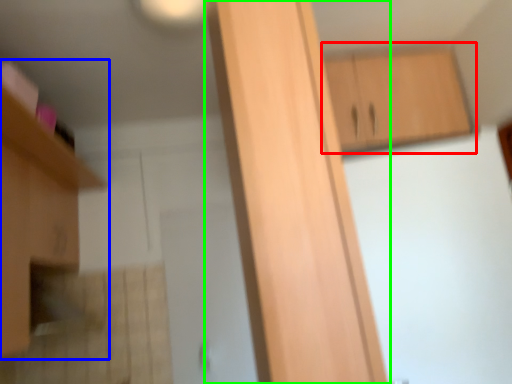
Question: Which object is the closest to the cabinetry (highlighted by a red box)? Choose among these: cabinetry (highlighted by a blue box) or cabinetry (highlighted by a green box).

Choices:
 (A) cabinetry
 (B) cabinetry

Answer: (B)